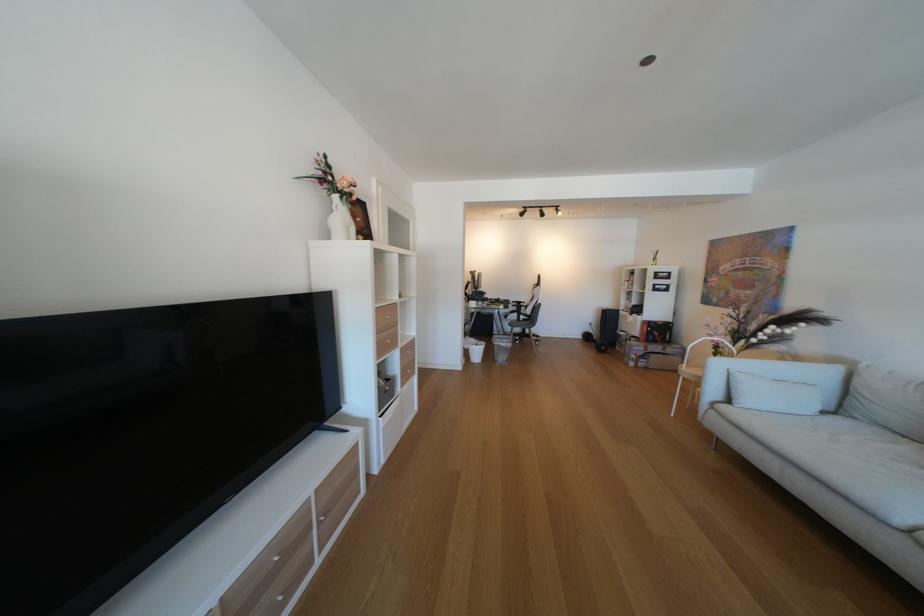
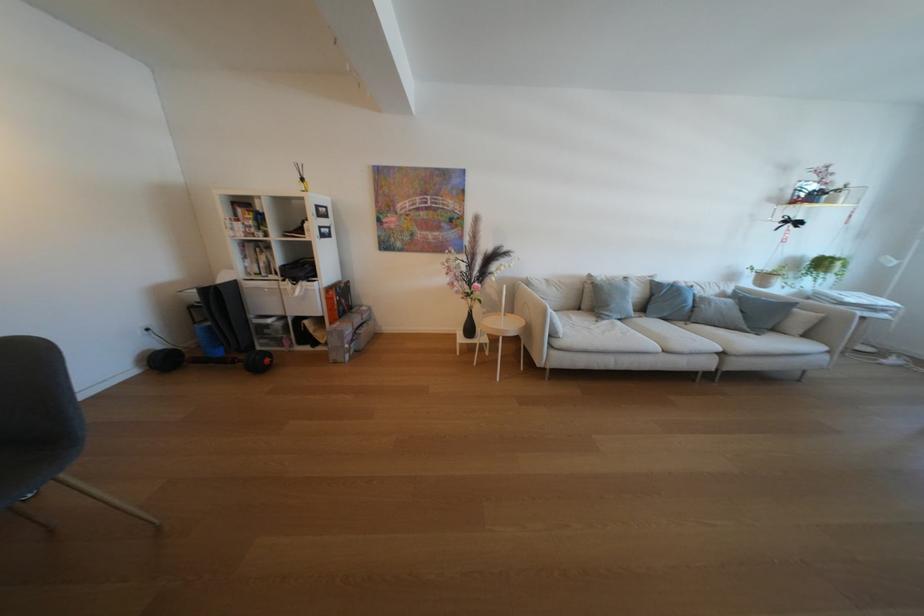
The point at (747, 406) is marked in the first image. Where is the corresponding point in the second image?

(572, 338)